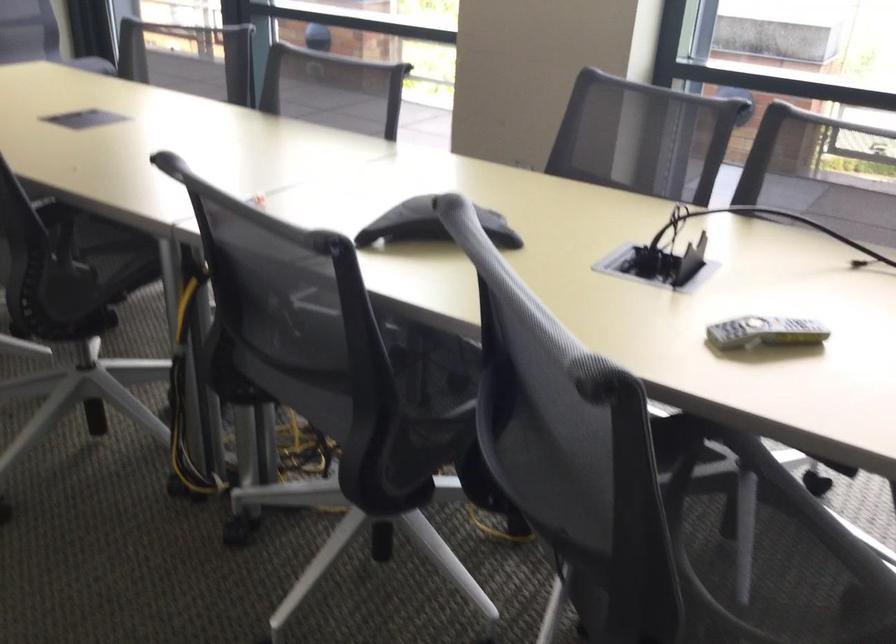
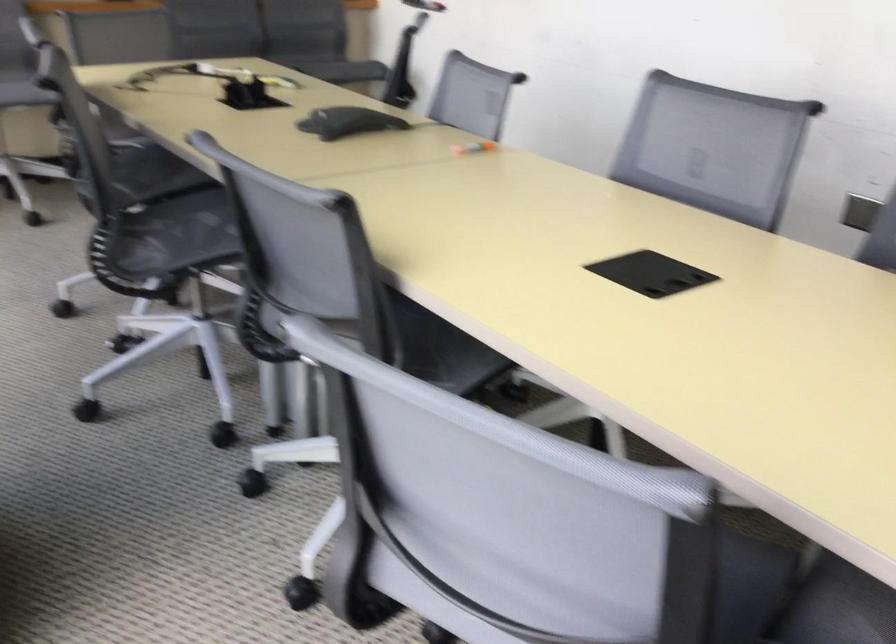
Question: I am providing you with two images of the same scene from different viewpoints. Please identify which objects are invisible in image2.

Choices:
 (A) chair sitting surface
 (B) orange marker
 (C) gray chair armrest
 (D) step stool top surface

Answer: (A)